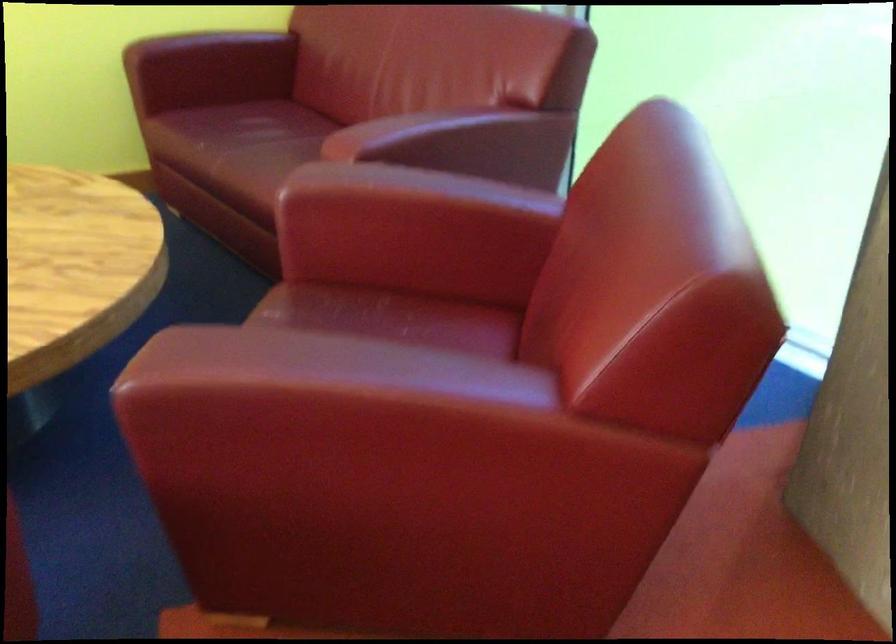
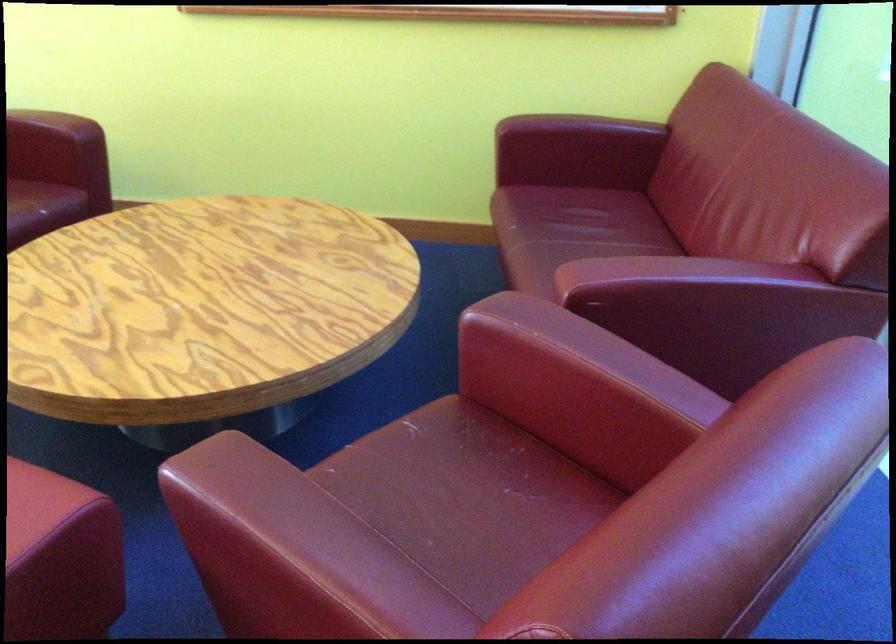
Find the pixel in the second image that matches point 373,171 in the first image.

(540, 319)